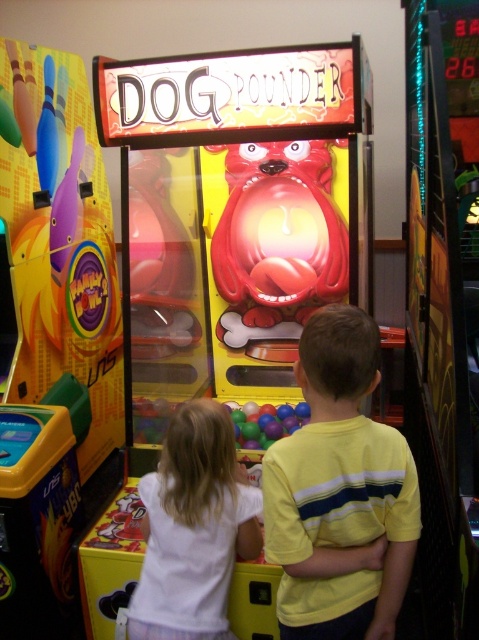
Who is taller, white cotton shirt at center or multicolored plastic balls at center?

white cotton shirt at center is taller.

Identify the location of white cotton shirt at center. This screenshot has width=479, height=640. (193, 529).

Does point (228, 428) come behind point (250, 440)?

No, (228, 428) is closer to viewer.

This screenshot has height=640, width=479. In order to click on white cotton shirt at center in this screenshot , I will do `click(193, 529)`.

Measure the distance between yellow striped shirt at center and multicolored plastic balls at center.

They are 1.01 meters apart.

Who is higher up, yellow striped shirt at center or multicolored plastic balls at center?

yellow striped shirt at center

Locate an element on the screen. Image resolution: width=479 pixels, height=640 pixels. yellow striped shirt at center is located at coordinates (340, 493).

Who is higher up, yellow striped shirt at center or white cotton shirt at center?

yellow striped shirt at center is above.

Between point (366, 621) and point (229, 465), which one is positioned in front?

Point (366, 621)

The height and width of the screenshot is (640, 479). I want to click on yellow striped shirt at center, so click(340, 493).